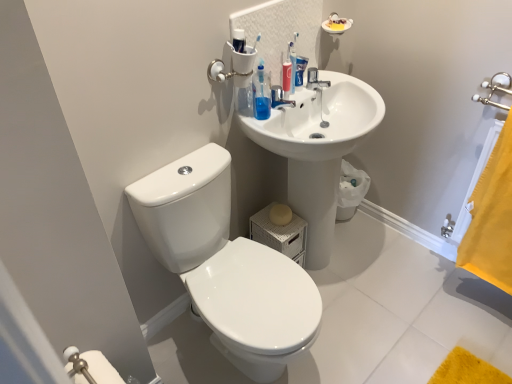
What are the coordinates of `vacant space to the right of metallic silver faucet at upper center` in the screenshot? It's located at coord(347,84).